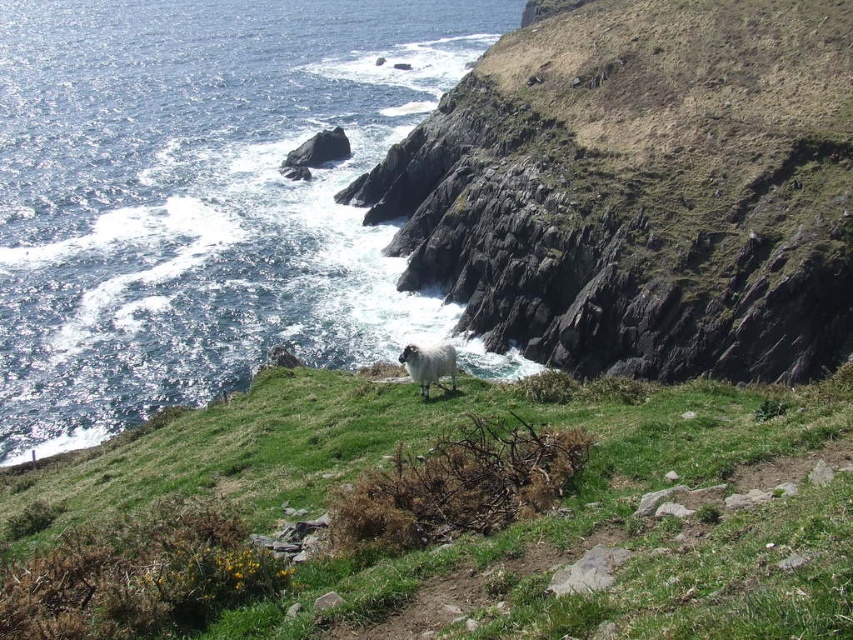
Question: Does green grassy at upper center have a lesser width compared to grassy hillside at upper right?

Choices:
 (A) yes
 (B) no

Answer: (A)

Question: In this image, where is green grassy at upper center located relative to grassy hillside at upper right?

Choices:
 (A) left
 (B) right

Answer: (A)

Question: Which of the following is the farthest from the observer?

Choices:
 (A) blue liquid water at upper left
 (B) green grassy at upper center
 (C) white woolly sheep at center

Answer: (A)

Question: Estimate the real-world distances between objects in this image. Which object is closer to the white woolly sheep at center?

Choices:
 (A) grassy hillside at upper right
 (B) blue liquid water at upper left

Answer: (A)

Question: Can you confirm if blue liquid water at upper left is positioned above grassy hillside at upper right?

Choices:
 (A) yes
 (B) no

Answer: (A)

Question: Which point appears farthest from the camera in this image?

Choices:
 (A) (440, 376)
 (B) (83, 310)
 (C) (265, 577)

Answer: (B)